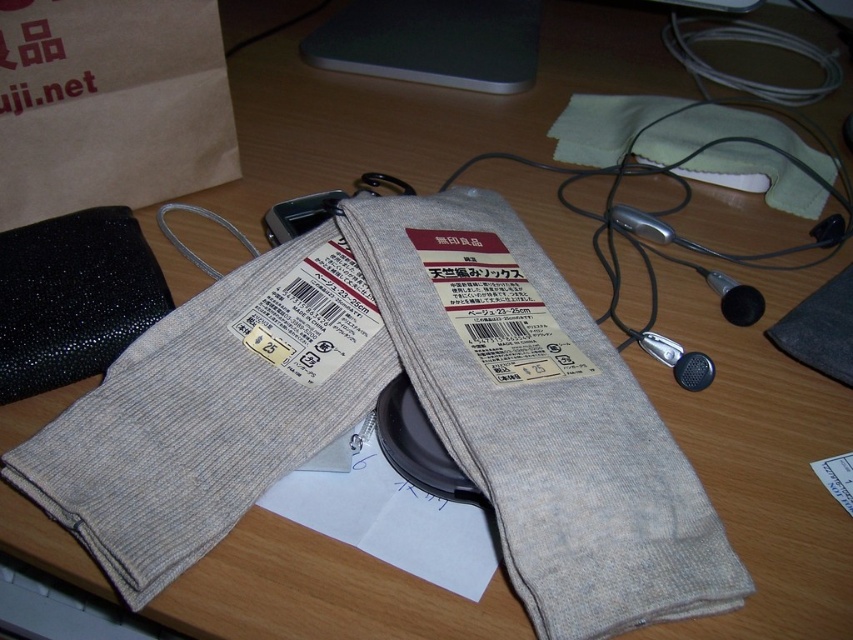
You are organizing items on a desk and need to place the gray knitted socks at center and the brown paper bag at upper left into a drawer. If the drawer can only fit items smaller than the socks, will both items fit?

The gray knitted socks at center has a larger size compared to brown paper bag at upper left. Since the drawer can only fit items smaller than the socks, the brown paper bag at upper left will fit, but the socks themselves will not.

You are trying to reach for the gray knitted socks at center on the desk. If your hand is 12 inches long, can you comfortably reach them without moving your arm?

The gray knitted socks at center are 20.19 inches away from the viewer. Since your hand is only 12 inches long, you cannot comfortably reach them without moving your arm.

You are organizing items on a desk and need to place a new item between the gray ribbed socks at center and the brown paper bag at upper left. What is the minimum distance you should leave between them to ensure there is enough space?

The minimum distance you should leave between the gray ribbed socks at center and the brown paper bag at upper left is 12.87 inches, as that is the current distance between them.